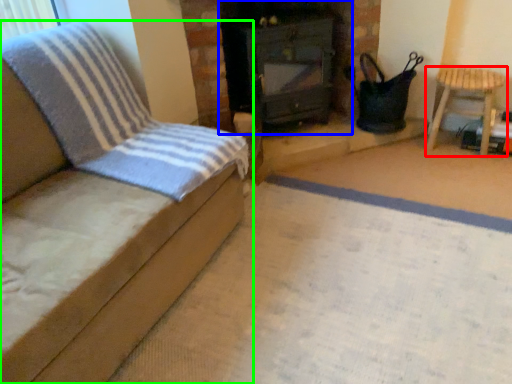
Question: Estimate the real-world distances between objects in this image. Which object is closer to furniture (highlighted by a red box), stove (highlighted by a blue box) or furniture (highlighted by a green box)?

Choices:
 (A) stove
 (B) furniture

Answer: (A)